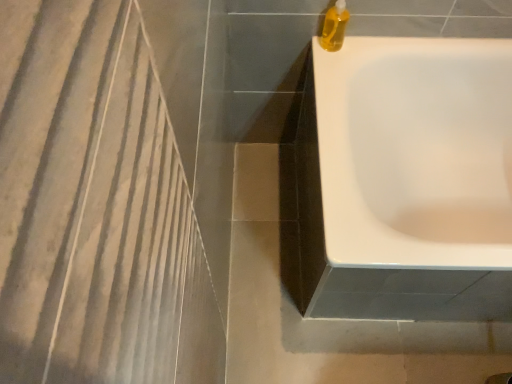
Question: Does point (328, 26) appear closer or farther from the camera than point (453, 188)?

Choices:
 (A) farther
 (B) closer

Answer: (B)

Question: From a real-world perspective, relative to white glossy bathtub at upper right, is translucent yellow liquid at top right vertically above or below?

Choices:
 (A) below
 (B) above

Answer: (B)

Question: Is translucent yellow liquid at top right wider or thinner than white glossy bathtub at upper right?

Choices:
 (A) thin
 (B) wide

Answer: (A)

Question: In terms of size, does white glossy bathtub at upper right appear bigger or smaller than translucent yellow liquid at top right?

Choices:
 (A) big
 (B) small

Answer: (A)

Question: Is white glossy bathtub at upper right spatially inside translucent yellow liquid at top right, or outside of it?

Choices:
 (A) outside
 (B) inside

Answer: (A)

Question: In terms of width, does white glossy bathtub at upper right look wider or thinner when compared to translucent yellow liquid at top right?

Choices:
 (A) thin
 (B) wide

Answer: (B)

Question: Considering their positions, is white glossy bathtub at upper right located in front of or behind translucent yellow liquid at top right?

Choices:
 (A) behind
 (B) front

Answer: (B)